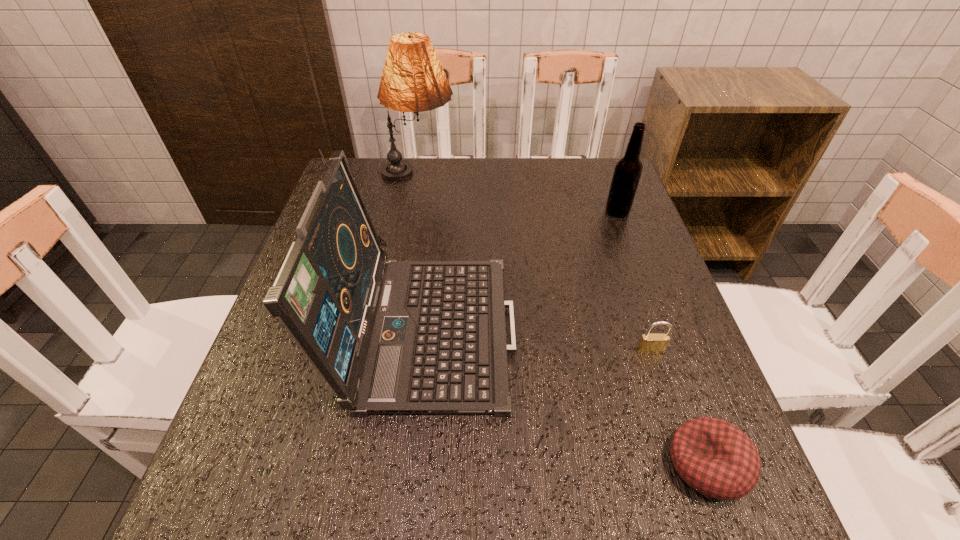
Find the location of a particular element. The image size is (960, 540). free location that satisfies the following two spatial constraints: 1. on the front-facing side of the beer bottle; 2. on the left side of the tallest object is located at coordinates 412,212.

The width and height of the screenshot is (960, 540). I want to click on vacant position in the image that satisfies the following two spatial constraints: 1. on the front-facing side of the tallest object; 2. on the left side of the fourth nearest object, so 412,212.

This screenshot has height=540, width=960. Identify the location of vacant space that satisfies the following two spatial constraints: 1. on the front-facing side of the fourth tallest object; 2. on the right side of the nearest object. (688, 464).

You are a GUI agent. You are given a task and a screenshot of the screen. Output one action in this format:
    pyautogui.click(x=<x>, y=<y>)
    Task: Click on the blank space that satisfies the following two spatial constraints: 1. on the front-facing side of the tallest object; 2. on the right side of the shortest object
    
    Given the screenshot: What is the action you would take?
    pyautogui.click(x=366, y=464)

At what (x,y) coordinates should I click in order to perform the action: click on vacant space that satisfies the following two spatial constraints: 1. on the back side of the beer bottle; 2. on the right side of the nearest object. Please return your answer as a coordinate pair (x, y). Looking at the image, I should click on (616, 212).